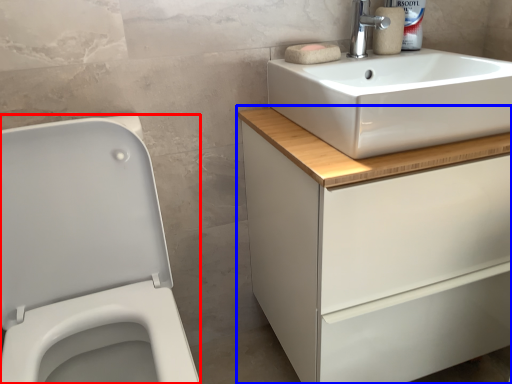
Question: Among these objects, which one is farthest to the camera, porcelain (highlighted by a red box) or bathroom cabinet (highlighted by a blue box)?

Choices:
 (A) porcelain
 (B) bathroom cabinet

Answer: (B)